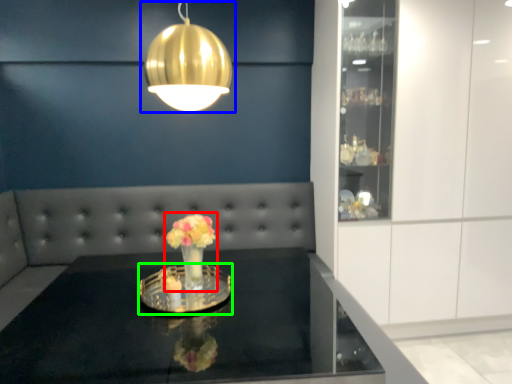
Question: Which object is positioned closest to floral arrangement (highlighted by a red box)? Select from lamp (highlighted by a blue box) and glass plate (highlighted by a green box).

Choices:
 (A) lamp
 (B) glass plate

Answer: (B)